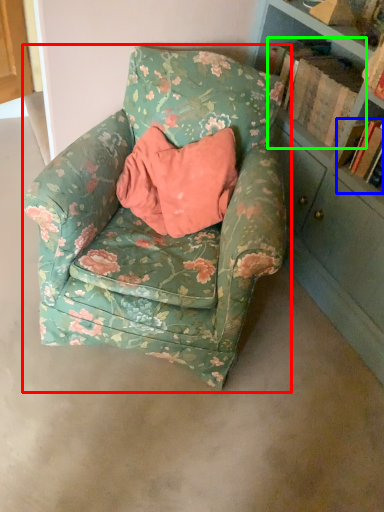
Question: Based on their relative distances, which object is nearer to chair (highlighted by a red box)? Choose from book (highlighted by a blue box) and book (highlighted by a green box).

Choices:
 (A) book
 (B) book

Answer: (B)